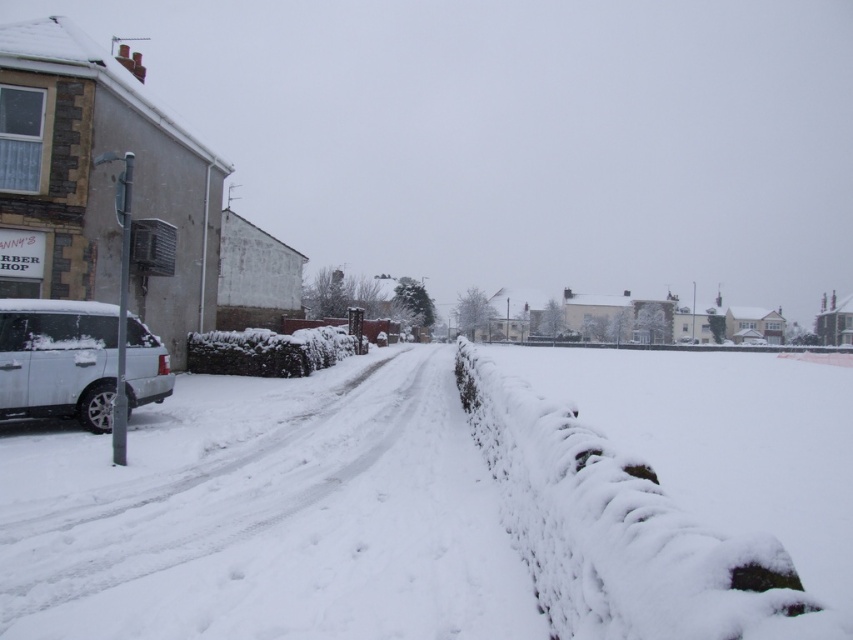
Does white fluffy snow at center have a greater height compared to sleek silver suv at left?

No.

Can you confirm if white fluffy snow at center is positioned above sleek silver suv at left?

Incorrect, white fluffy snow at center is not positioned above sleek silver suv at left.

What do you see at coordinates (422, 502) in the screenshot? I see `white fluffy snow at center` at bounding box center [422, 502].

Locate an element on the screen. The height and width of the screenshot is (640, 853). white fluffy snow at center is located at coordinates (422, 502).